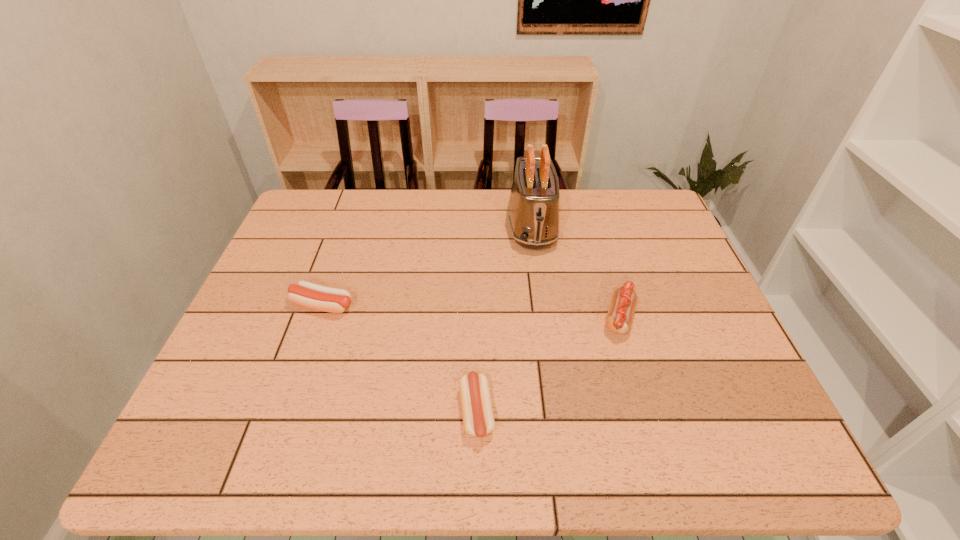
Where is `toaster`? This screenshot has height=540, width=960. toaster is located at coordinates (533, 212).

Locate an element on the screen. The width and height of the screenshot is (960, 540). the farthest object is located at coordinates (533, 212).

Locate an element on the screen. This screenshot has height=540, width=960. the second tallest object is located at coordinates (619, 318).

Locate an element on the screen. the tallest sausage is located at coordinates (619, 318).

The height and width of the screenshot is (540, 960). Identify the location of the leftmost sausage. (334, 300).

The width and height of the screenshot is (960, 540). What are the coordinates of `the second object from left to right` in the screenshot? It's located at (478, 419).

The image size is (960, 540). What are the coordinates of `the nearest sausage` in the screenshot? It's located at (478, 419).

In order to click on free space located on the side of the toaster with the control lever in this screenshot , I will do `click(543, 311)`.

You are a GUI agent. You are given a task and a screenshot of the screen. Output one action in this format:
    pyautogui.click(x=<x>, y=<y>)
    Task: Click on the free point located on the front of the third shortest object
    
    Given the screenshot: What is the action you would take?
    pyautogui.click(x=640, y=389)

Locate an element on the screen. vacant region located on the front of the leftmost sausage is located at coordinates (298, 378).